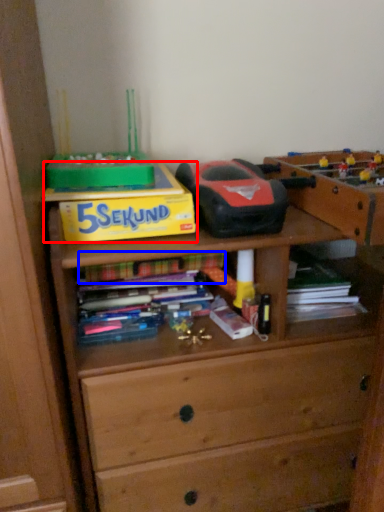
Question: Which object appears closest to the camera in this image, paperback book (highlighted by a red box) or book (highlighted by a blue box)?

Choices:
 (A) paperback book
 (B) book

Answer: (A)